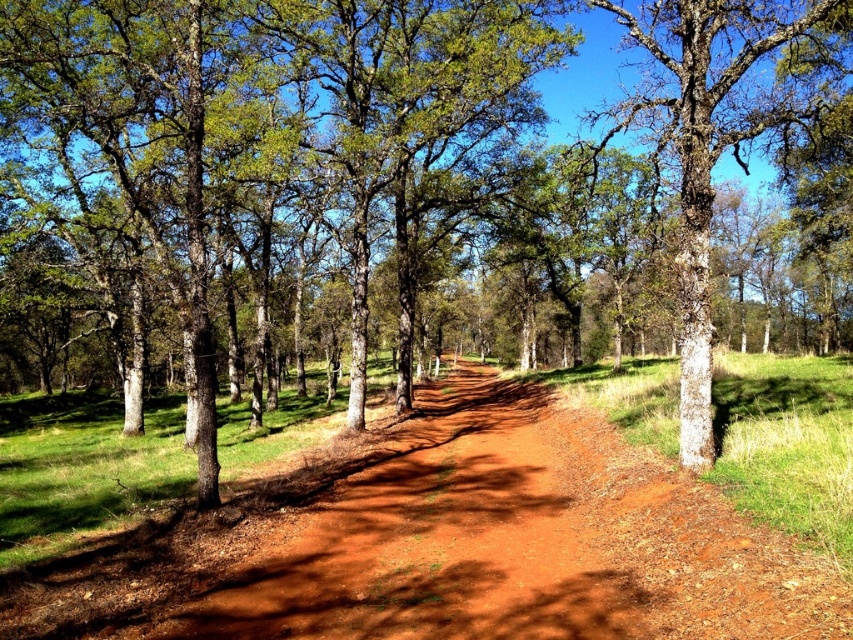
Question: Is dusty red dirt track at center wider than bark textured tree at center?

Choices:
 (A) no
 (B) yes

Answer: (A)

Question: Among these objects, which one is farthest from the camera?

Choices:
 (A) dusty red dirt track at center
 (B) bark textured tree at center

Answer: (B)

Question: Does dusty red dirt track at center have a lesser width compared to bark textured tree at center?

Choices:
 (A) no
 (B) yes

Answer: (B)

Question: Observing the image, what is the correct spatial positioning of dusty red dirt track at center in reference to bark textured tree at center?

Choices:
 (A) right
 (B) left

Answer: (B)